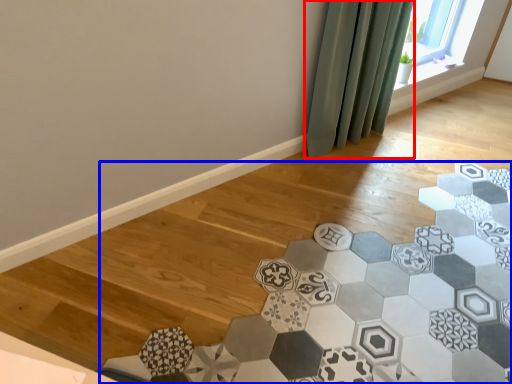
Question: Among these objects, which one is farthest to the camera, curtain (highlighted by a red box) or ceramic tile (highlighted by a blue box)?

Choices:
 (A) curtain
 (B) ceramic tile

Answer: (A)